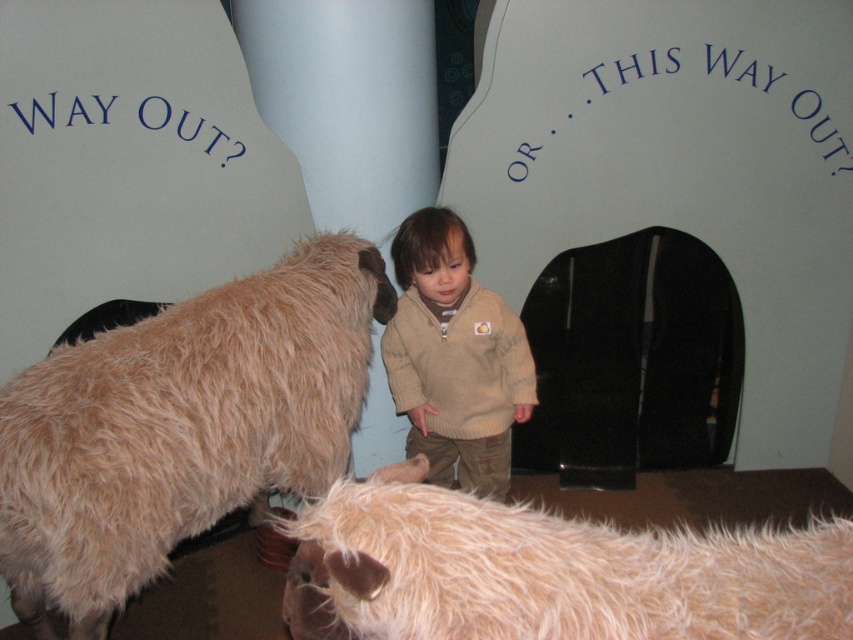
You are a parent trying to take a photo of your child with the fluffy beige goat at lower center and the beige knitted sweater at center. To ensure both objects are fully visible in the frame, which one requires you to adjust your camera angle more due to its size?

The fluffy beige goat at lower center might be wider than the beige knitted sweater at center, so you need to adjust the camera angle more to include the entire width of the fluffy beige goat at lower center in the photo.

You are the child in the scene. You see the fluffy beige goat at lower center and the beige knitted sweater at center. Which object is positioned to the right of the other?

The fluffy beige goat at lower center is to the right of the beige knitted sweater at center.